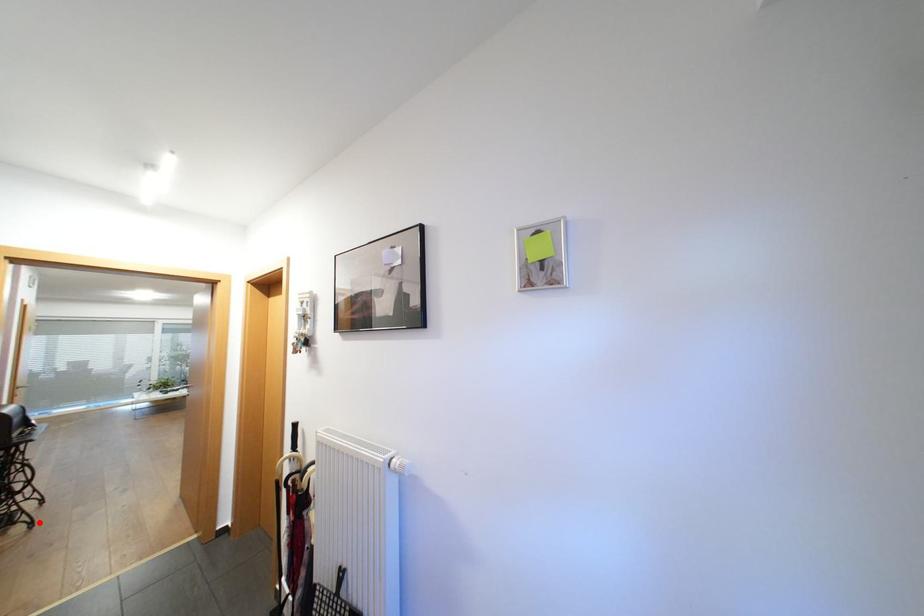
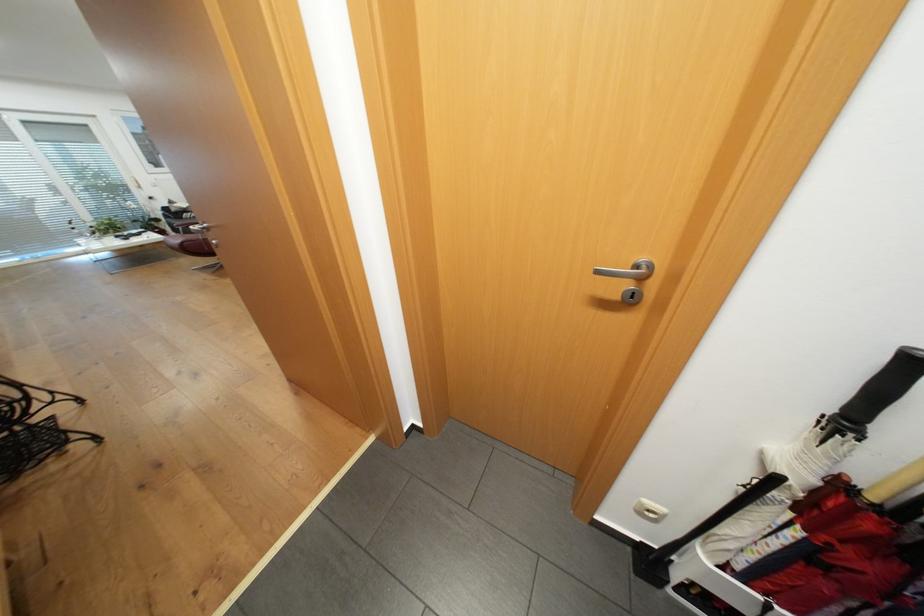
Locate, in the second image, the point that corresponds to the highlighted location in the first image.

(102, 438)